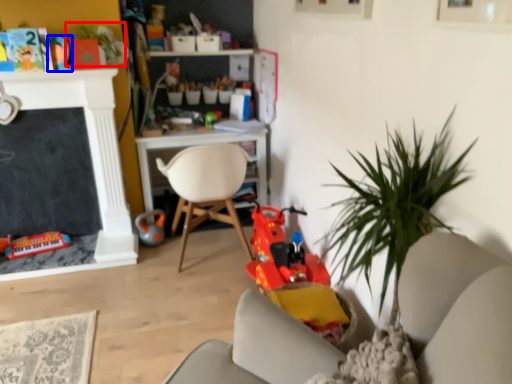
Question: Which of the following is the closest to the observer, plant (highlighted by a red box) or toy (highlighted by a blue box)?

Choices:
 (A) plant
 (B) toy

Answer: (A)